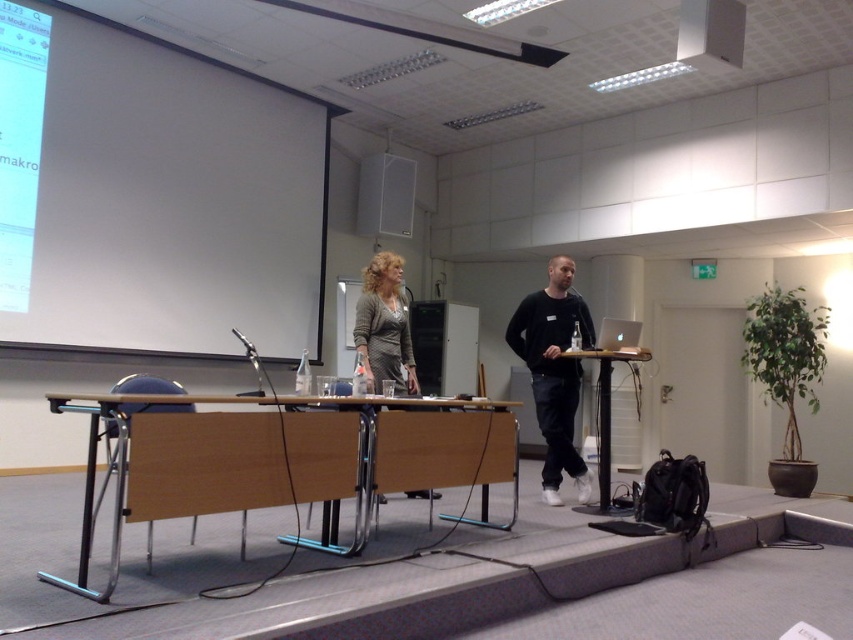
Based on the provided scene description, what object is located at the coordinates point (152,196)?

The object at point (152,196) is the white matte projection screen at upper left.

You are an event organizer setting up for a presentation. You need to place a large banner behind the wooden at center and the black plastic table at center. Which object should the banner be placed behind to ensure both are visible from the audience seats?

The banner should be placed behind the black plastic table at center because the wooden at center is located below it, so placing the banner behind the higher black plastic table would allow both objects to be visible from the audience seats.